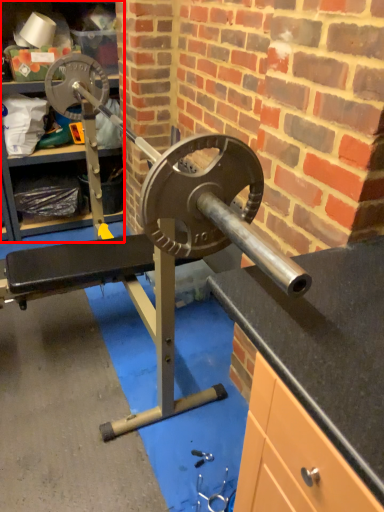
Question: From the image's perspective, what is the correct spatial relationship of cabinet (annotated by the red box) in relation to tool?

Choices:
 (A) below
 (B) above

Answer: (B)